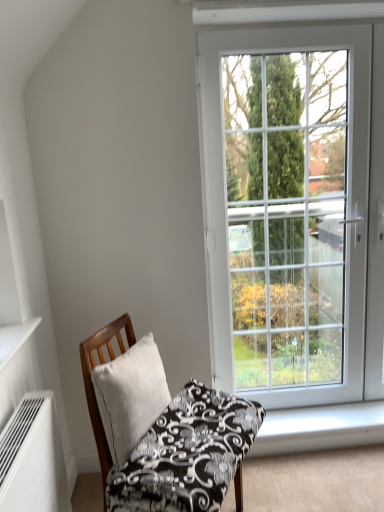
Question: From the image's perspective, does white linen pillow at center appear higher than white matte air conditioner at lower left?

Choices:
 (A) yes
 (B) no

Answer: (A)

Question: Does white linen pillow at center contain white matte air conditioner at lower left?

Choices:
 (A) yes
 (B) no

Answer: (B)

Question: From a real-world perspective, is white linen pillow at center over white matte air conditioner at lower left?

Choices:
 (A) no
 (B) yes

Answer: (B)

Question: Considering the relative sizes of white linen pillow at center and white matte air conditioner at lower left in the image provided, is white linen pillow at center taller than white matte air conditioner at lower left?

Choices:
 (A) yes
 (B) no

Answer: (B)

Question: From a real-world perspective, is white linen pillow at center located beneath white matte air conditioner at lower left?

Choices:
 (A) yes
 (B) no

Answer: (B)

Question: In terms of height, does wooden chair with patterned cushion at lower left look taller or shorter compared to white smooth window sill at lower right?

Choices:
 (A) tall
 (B) short

Answer: (A)

Question: In the image, is wooden chair with patterned cushion at lower left positioned in front of or behind white smooth window sill at lower right?

Choices:
 (A) front
 (B) behind

Answer: (A)

Question: From the image's perspective, is wooden chair with patterned cushion at lower left positioned above or below white smooth window sill at lower right?

Choices:
 (A) below
 (B) above

Answer: (B)

Question: Considering the positions of wooden chair with patterned cushion at lower left and white smooth window sill at lower right in the image, is wooden chair with patterned cushion at lower left wider or thinner than white smooth window sill at lower right?

Choices:
 (A) thin
 (B) wide

Answer: (B)

Question: From a real-world perspective, is white matte shelf at upper left above or below white linen pillow at center?

Choices:
 (A) above
 (B) below

Answer: (A)

Question: From the image's perspective, is white matte shelf at upper left positioned above or below white linen pillow at center?

Choices:
 (A) above
 (B) below

Answer: (A)

Question: Considering the positions of white matte shelf at upper left and white linen pillow at center in the image, is white matte shelf at upper left wider or thinner than white linen pillow at center?

Choices:
 (A) thin
 (B) wide

Answer: (B)

Question: Is white matte shelf at upper left taller or shorter than white linen pillow at center?

Choices:
 (A) short
 (B) tall

Answer: (A)

Question: Is point (16, 408) positioned closer to the camera than point (122, 370)?

Choices:
 (A) farther
 (B) closer

Answer: (B)

Question: Considering the positions of white matte air conditioner at lower left and white linen pillow at center in the image, is white matte air conditioner at lower left wider or thinner than white linen pillow at center?

Choices:
 (A) wide
 (B) thin

Answer: (A)